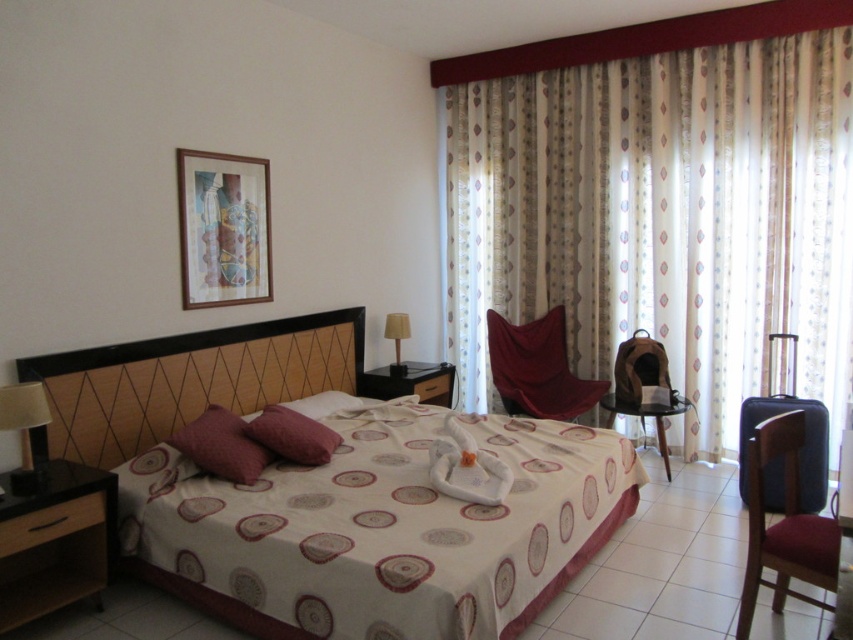
Consider the image. You are standing in the hotel room and want to take a photo of both the point at coordinates point (517, 380) and point (48, 412). Which point should you focus on first to ensure both are in focus?

You should focus on point (517, 380) first because it is closer to the camera than point (48, 412), ensuring both points are within the depth of field.

You are a hotel guest who wants to place a 60 cm wide decorative item between the patterned fabric curtain at center and the velvet red armchair at center. Is there enough space to fit it without moving either object?

The distance between the patterned fabric curtain at center and the velvet red armchair at center is 66.25 centimeters. Since the decorative item is 60 cm wide, there is enough space to place it between them without moving either object.

You are a guest in the hotel room and want to place a rectangular box that is 1.2 meters wide on the floor. The velvet red armchair at center and the matte black lamp at left are both in your way. Which object should you move to make space for the box?

The velvet red armchair at center is wider than the matte black lamp at left, so moving the velvet red armchair at center would create more space for the 1.2 meters wide box.